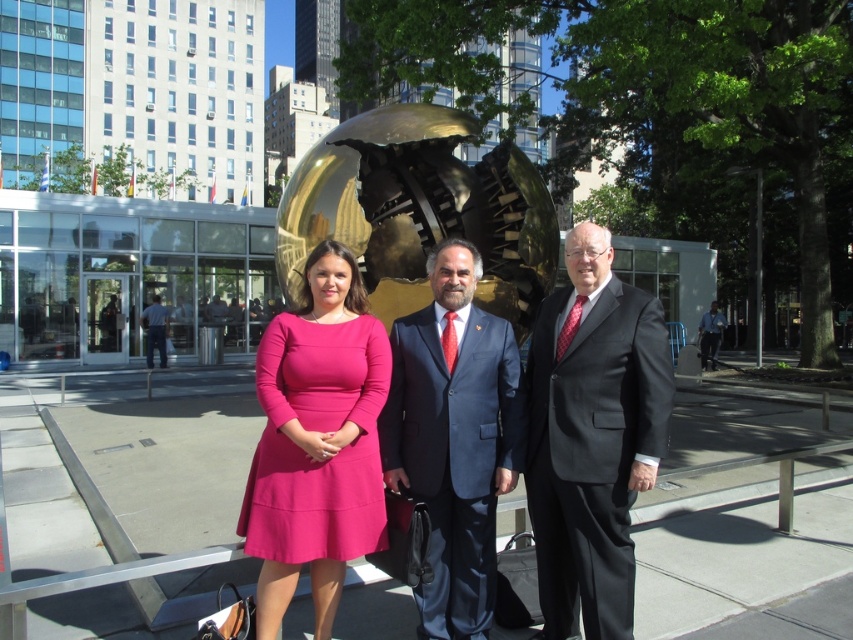
Which of these two, pink satin dress at center or blue jeans at left, stands shorter?

With less height is pink satin dress at center.

Who is more distant from viewer, (384, 449) or (151, 364)?

Point (151, 364)

In order to click on pink satin dress at center in this screenshot , I will do `click(593, 428)`.

Does pink satin dress at center have a lesser width compared to matte pink dress at center?

Incorrect, pink satin dress at center's width is not less than matte pink dress at center's.

Between point (637, 332) and point (296, 536), which one is positioned in front?

Positioned in front is point (296, 536).

Find the location of a particular element. This screenshot has height=640, width=853. pink satin dress at center is located at coordinates (593, 428).

Which of these two, gold polished sphere at center or matte pink dress at center, stands taller?

matte pink dress at center

Between point (428, 140) and point (279, 531), which one is positioned behind?

Point (428, 140)

What do you see at coordinates (421, 211) in the screenshot? Image resolution: width=853 pixels, height=640 pixels. I see `gold polished sphere at center` at bounding box center [421, 211].

Where is `gold polished sphere at center`? The image size is (853, 640). gold polished sphere at center is located at coordinates (421, 211).